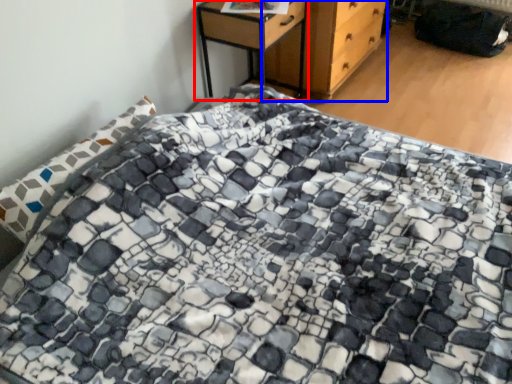
Question: Which object is closer to the camera taking this photo, nightstand (highlighted by a red box) or chest of drawers (highlighted by a blue box)?

Choices:
 (A) nightstand
 (B) chest of drawers

Answer: (A)